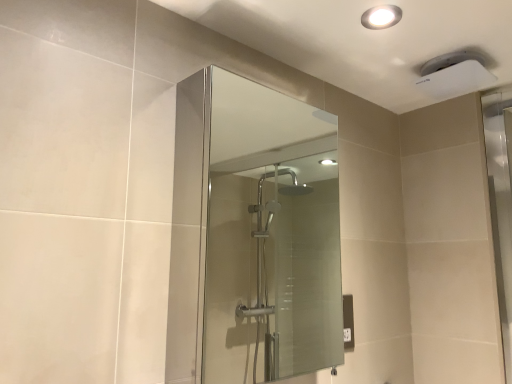
Identify the location of clear glass mirror at center. The image size is (512, 384). (270, 237).

Measure the distance between clear glass mirror at center and camera.

clear glass mirror at center is 1.04 meters from camera.

The image size is (512, 384). What do you see at coordinates (270, 237) in the screenshot?
I see `clear glass mirror at center` at bounding box center [270, 237].

Locate an element on the screen. This screenshot has height=384, width=512. clear glass mirror at center is located at coordinates (270, 237).